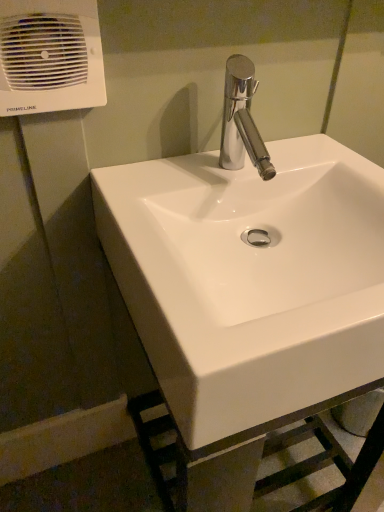
Question: Which is correct: white glossy sink at center is inside white plastic air conditioning unit at upper left, or outside of it?

Choices:
 (A) inside
 (B) outside

Answer: (B)

Question: In the image, is white glossy sink at center positioned in front of or behind white plastic air conditioning unit at upper left?

Choices:
 (A) behind
 (B) front

Answer: (B)

Question: From the image's perspective, relative to white plastic air conditioning unit at upper left, is white glossy sink at center above or below?

Choices:
 (A) below
 (B) above

Answer: (A)

Question: From a real-world perspective, is white plastic air conditioning unit at upper left physically located above or below white glossy sink at center?

Choices:
 (A) below
 (B) above

Answer: (B)

Question: Do you think white plastic air conditioning unit at upper left is within white glossy sink at center, or outside of it?

Choices:
 (A) outside
 (B) inside

Answer: (A)

Question: From the image's perspective, is white plastic air conditioning unit at upper left located above or below white glossy sink at center?

Choices:
 (A) below
 (B) above

Answer: (B)

Question: In terms of width, does white plastic air conditioning unit at upper left look wider or thinner when compared to white glossy sink at center?

Choices:
 (A) thin
 (B) wide

Answer: (A)